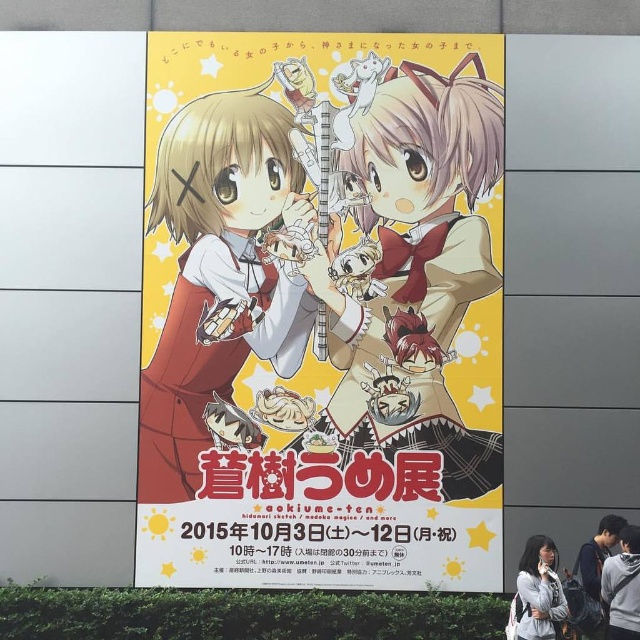
From the picture: You are an event organizer planning to place a small banner on the poster. The banner needs to be placed to the left of the light gray fabric jacket at lower right. Based on the poster layout, where should you position the banner?

The light gray fabric jacket at lower right is located at point (538, 592), so the banner should be placed to the left of this coordinate to ensure proper alignment.

You are standing in front of the poster and want to touch both the matte red dress at center and the light gray fabric jacket at lower right. If you can only move 15 feet forward, will you be able to reach both objects?

The matte red dress at center is 17.24 feet away from the light gray fabric jacket at lower right. Since you can only move 15 feet forward, you won answer to reach both objects because the distance between them exceeds your movement limit.